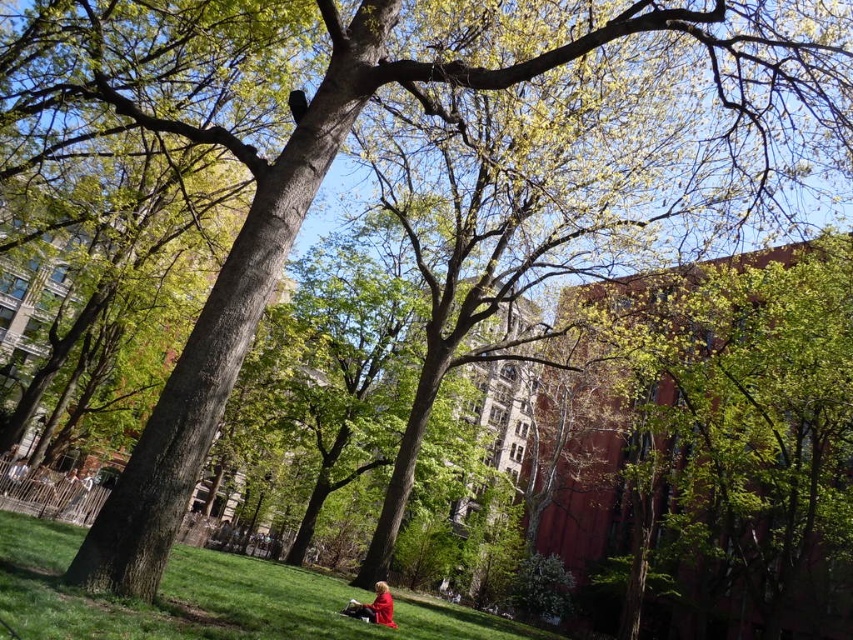
You are a photographer trying to capture a photo of the red fabric person at lower center without the green leafy tree at upper right blocking the view. Based on their heights, can you position yourself so that the tree doesn

The green leafy tree at upper right is taller than the red fabric person at lower center. Since the tree is taller, positioning yourself at a lower angle might allow you to frame the person without the tree obstructing the view.

In the scene shown: You are standing at the center of the park and want to take a photo of the green leafy tree at upper right. Which direction should you face to ensure the tree is in the frame?

The green leafy tree at upper right is located at point [735,424], so you should face towards the upper right direction to include it in your photo.

You are a park visitor who wants to place a 10 meter long picnic blanket between the green leafy tree at upper right and the green grass at lower center. Is there enough space to fully spread out the picnic blanket without folding it?

The distance between the green leafy tree at upper right and the green grass at lower center is 11.57 meters, so yes, the 10 meter long picnic blanket can be fully spread out without folding since the space is sufficient.